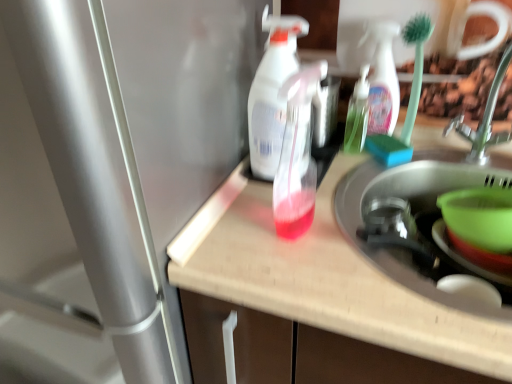
Find the location of a particular element. vacant space in front of green plastic brush at upper right is located at coordinates (393, 174).